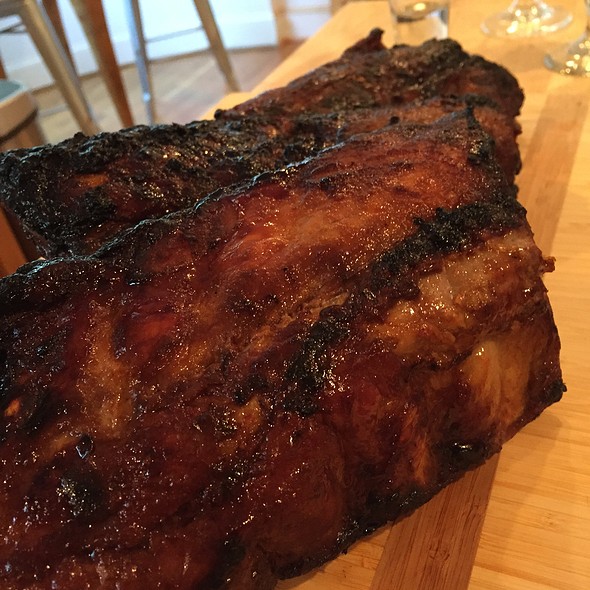
Identify the location of wooden table. (565, 167).